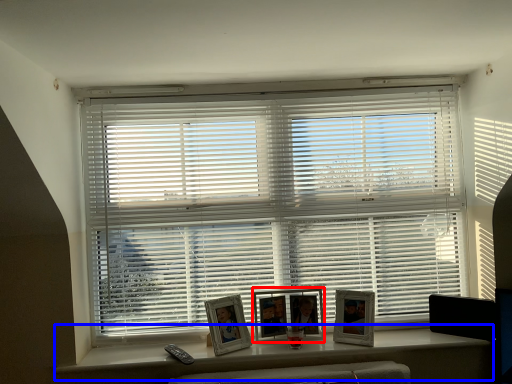
Question: Which object appears farthest to the camera in this image, picture frame (highlighted by a red box) or window (highlighted by a blue box)?

Choices:
 (A) picture frame
 (B) window

Answer: (A)